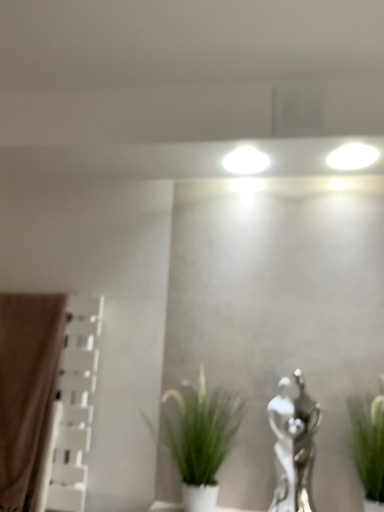
This screenshot has width=384, height=512. In order to click on silver metallic statue at center-right in this screenshot , I will do `click(294, 445)`.

This screenshot has width=384, height=512. What do you see at coordinates (26, 389) in the screenshot? I see `brown fabric curtain at left` at bounding box center [26, 389].

Describe the element at coordinates (368, 444) in the screenshot. I see `green leafy plant at right, arranged as the first houseplant when viewed from the right` at that location.

Locate an element on the screen. This screenshot has width=384, height=512. silver metallic statue at center-right is located at coordinates (294, 445).

Would you say brown fabric curtain at left is inside or outside green leafy plant at right, arranged as the first houseplant when viewed from the right?

brown fabric curtain at left cannot be found inside green leafy plant at right, arranged as the first houseplant when viewed from the right.

Is brown fabric curtain at left behind green leafy plant at right, marked as the 2th houseplant in a left-to-right arrangement?

Yes, it is.

How different are the orientations of brown fabric curtain at left and green leafy plant at right, arranged as the first houseplant when viewed from the right, in degrees?

Result: The facing directions of brown fabric curtain at left and green leafy plant at right, arranged as the first houseplant when viewed from the right, are 2.53 degrees apart.

From a real-world perspective, does silver metallic statue at center-right sit lower than green matte plant at center, the first houseplant when ordered from left to right?

No, from a real-world perspective, silver metallic statue at center-right is not beneath green matte plant at center, the first houseplant when ordered from left to right.

Is the position of silver metallic statue at center-right more distant than that of green matte plant at center, the first houseplant when ordered from left to right?

Yes, silver metallic statue at center-right is behind green matte plant at center, the first houseplant when ordered from left to right.

Considering the points (296, 459) and (205, 385), which point is in front, point (296, 459) or point (205, 385)?

The point (296, 459) is closer.

From the picture: Is silver metallic statue at center-right next to green matte plant at center, the first houseplant when ordered from left to right?

silver metallic statue at center-right and green matte plant at center, the first houseplant when ordered from left to right, are clearly separated.

Can you tell me how much green leafy plant at right, marked as the 2th houseplant in a left-to-right arrangement, and silver metallic statue at center-right differ in facing direction?

They differ by 1.36 degrees in their facing directions.

Is green leafy plant at right, marked as the 2th houseplant in a left-to-right arrangement, placed right next to silver metallic statue at center-right?

No, green leafy plant at right, marked as the 2th houseplant in a left-to-right arrangement, is not next to silver metallic statue at center-right.

In terms of height, does green leafy plant at right, arranged as the first houseplant when viewed from the right, look taller or shorter compared to silver metallic statue at center-right?

green leafy plant at right, arranged as the first houseplant when viewed from the right, is shorter than silver metallic statue at center-right.

Looking at this image, who is smaller, green leafy plant at right, arranged as the first houseplant when viewed from the right, or silver metallic statue at center-right?

With smaller size is silver metallic statue at center-right.

From the picture: Is brown fabric curtain at left a part of silver metallic statue at center-right?

That's incorrect, brown fabric curtain at left is not inside silver metallic statue at center-right.

Can you confirm if silver metallic statue at center-right is taller than brown fabric curtain at left?

In fact, silver metallic statue at center-right may be shorter than brown fabric curtain at left.

Is silver metallic statue at center-right far away from brown fabric curtain at left?

No.

From a real-world perspective, which is physically above, silver metallic statue at center-right or brown fabric curtain at left?

In real-world perspective, brown fabric curtain at left is above.

Does point (192, 433) lie in front of point (362, 484)?

No, (192, 433) is further to viewer.

In the image, there is a green leafy plant at right, marked as the 2th houseplant in a left-to-right arrangement. In order to click on houseplant below it (from the image's perspective) in this screenshot , I will do `click(198, 437)`.

Considering the relative sizes of green matte plant at center, the first houseplant when ordered from left to right, and green leafy plant at right, marked as the 2th houseplant in a left-to-right arrangement, in the image provided, is green matte plant at center, the first houseplant when ordered from left to right, smaller than green leafy plant at right, marked as the 2th houseplant in a left-to-right arrangement,?

Incorrect, green matte plant at center, the first houseplant when ordered from left to right, is not smaller in size than green leafy plant at right, marked as the 2th houseplant in a left-to-right arrangement.

Who is shorter, green matte plant at center, arranged as the second houseplant when viewed from the right, or green leafy plant at right, arranged as the first houseplant when viewed from the right?

Standing shorter between the two is green leafy plant at right, arranged as the first houseplant when viewed from the right.

Would you say green matte plant at center, arranged as the second houseplant when viewed from the right, is part of green leafy plant at right, marked as the 2th houseplant in a left-to-right arrangement,'s contents?

No.

Is point (352, 443) positioned in front of point (185, 441)?

Yes, it is.

Can you confirm if green leafy plant at right, marked as the 2th houseplant in a left-to-right arrangement, is shorter than green matte plant at center, arranged as the second houseplant when viewed from the right?

Yes.

Considering the relative positions of green leafy plant at right, arranged as the first houseplant when viewed from the right, and green matte plant at center, arranged as the second houseplant when viewed from the right, in the image provided, is green leafy plant at right, arranged as the first houseplant when viewed from the right, to the left of green matte plant at center, arranged as the second houseplant when viewed from the right, from the viewer's perspective?

No.

Can you tell me how much brown fabric curtain at left and silver metallic statue at center-right differ in facing direction?

They differ by 1.16 degrees in their facing directions.

From the image's perspective, is brown fabric curtain at left located above silver metallic statue at center-right?

Yes.

In the image, is brown fabric curtain at left on the left side or the right side of silver metallic statue at center-right?

In the image, brown fabric curtain at left appears on the left side of silver metallic statue at center-right.

Based on the photo, how much distance is there between brown fabric curtain at left and silver metallic statue at center-right?

brown fabric curtain at left is 31.56 inches away from silver metallic statue at center-right.

From the image's perspective, count 1st houseplants downward from the brown fabric curtain at left and point to it. Please provide its 2D coordinates.

[(368, 444)]

The image size is (384, 512). I want to click on the 1st houseplant in front of the silver metallic statue at center-right, starting your count from the anchor, so click(198, 437).

Which object lies nearer to the anchor point green leafy plant at right, marked as the 2th houseplant in a left-to-right arrangement, green matte plant at center, the first houseplant when ordered from left to right, or brown fabric curtain at left?

green matte plant at center, the first houseplant when ordered from left to right.

Considering their positions, is green leafy plant at right, marked as the 2th houseplant in a left-to-right arrangement, positioned further to brown fabric curtain at left than green matte plant at center, arranged as the second houseplant when viewed from the right?

green leafy plant at right, marked as the 2th houseplant in a left-to-right arrangement.

Looking at the image, which one is located further to green matte plant at center, arranged as the second houseplant when viewed from the right, brown fabric curtain at left or green leafy plant at right, arranged as the first houseplant when viewed from the right?

brown fabric curtain at left lies further to green matte plant at center, arranged as the second houseplant when viewed from the right, than the other object.

Consider the image. Based on their spatial positions, is green matte plant at center, arranged as the second houseplant when viewed from the right, or green leafy plant at right, marked as the 2th houseplant in a left-to-right arrangement, closer to silver metallic statue at center-right?

green leafy plant at right, marked as the 2th houseplant in a left-to-right arrangement, is closer to silver metallic statue at center-right.

Considering their positions, is silver metallic statue at center-right positioned further to brown fabric curtain at left than green leafy plant at right, marked as the 2th houseplant in a left-to-right arrangement?

green leafy plant at right, marked as the 2th houseplant in a left-to-right arrangement, is further to brown fabric curtain at left.

Estimate the real-world distances between objects in this image. Which object is closer to brown fabric curtain at left, green matte plant at center, arranged as the second houseplant when viewed from the right, or silver metallic statue at center-right?

green matte plant at center, arranged as the second houseplant when viewed from the right.

Based on the photo, looking at the image, which one is located closer to green leafy plant at right, marked as the 2th houseplant in a left-to-right arrangement, green matte plant at center, the first houseplant when ordered from left to right, or silver metallic statue at center-right?

silver metallic statue at center-right lies closer to green leafy plant at right, marked as the 2th houseplant in a left-to-right arrangement, than the other object.

Estimate the real-world distances between objects in this image. Which object is closer to silver metallic statue at center-right, brown fabric curtain at left or green matte plant at center, arranged as the second houseplant when viewed from the right?

green matte plant at center, arranged as the second houseplant when viewed from the right, lies closer to silver metallic statue at center-right than the other object.

At what (x,y) coordinates should I click in order to perform the action: click on houseplant situated between brown fabric curtain at left and silver metallic statue at center-right from left to right. Please return your answer as a coordinate pair (x, y). Image resolution: width=384 pixels, height=512 pixels. Looking at the image, I should click on (198, 437).

Find the location of a particular element. The height and width of the screenshot is (512, 384). houseplant between brown fabric curtain at left and green leafy plant at right, marked as the 2th houseplant in a left-to-right arrangement is located at coordinates (198, 437).

The width and height of the screenshot is (384, 512). In order to click on art between green matte plant at center, arranged as the second houseplant when viewed from the right, and green leafy plant at right, arranged as the first houseplant when viewed from the right in this screenshot , I will do `click(294, 445)`.

In order to click on art between brown fabric curtain at left and green leafy plant at right, arranged as the first houseplant when viewed from the right in this screenshot , I will do `click(294, 445)`.